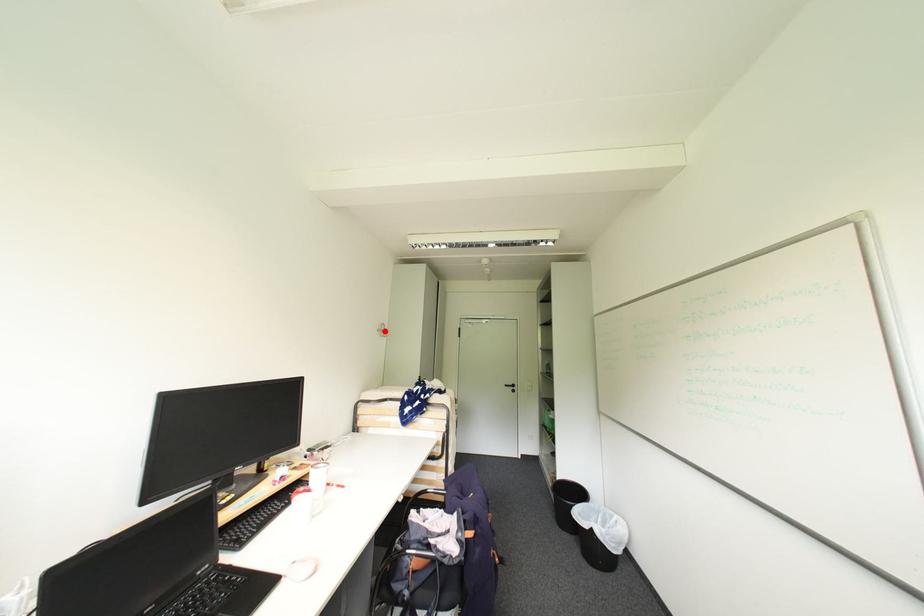
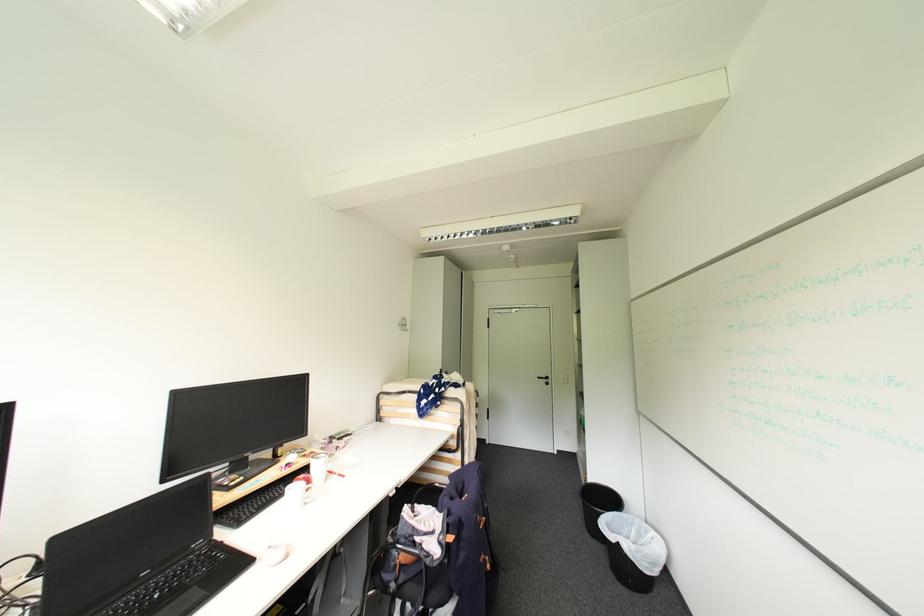
In the second image, find the point that corresponds to the highlighted location in the first image.

(406, 325)